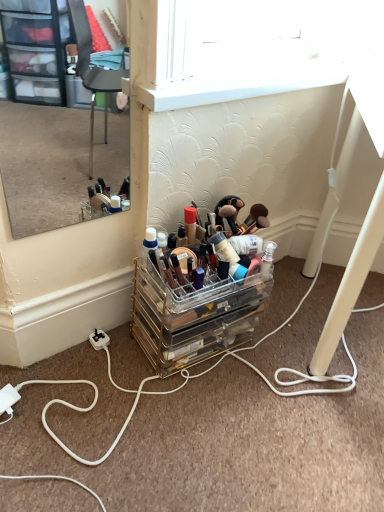
The image size is (384, 512). Describe the element at coordinates (228, 441) in the screenshot. I see `white cord at lower left` at that location.

Image resolution: width=384 pixels, height=512 pixels. What do you see at coordinates (99, 339) in the screenshot?
I see `white plastic power outlet at lower left` at bounding box center [99, 339].

You are a GUI agent. You are given a task and a screenshot of the screen. Output one action in this format:
    pyautogui.click(x=<x>, y=<y>)
    Task: Click on the clear acrylic makeup organizer at lower center
    The height and width of the screenshot is (512, 384).
    Given the screenshot: What is the action you would take?
    pyautogui.click(x=238, y=236)

The width and height of the screenshot is (384, 512). What are the coordinates of `white cord at lower left` in the screenshot? It's located at (228, 441).

Looking at this image, does clear glass mirror at upper left touch white cord at lower left?

No, clear glass mirror at upper left is not touching white cord at lower left.

Is white cord at lower left a part of clear glass mirror at upper left?

That's incorrect, white cord at lower left is not inside clear glass mirror at upper left.

Identify the location of mirror in front of the white cord at lower left. (57, 119).

Can you confirm if clear glass mirror at upper left is thinner than white cord at lower left?

Yes, clear glass mirror at upper left is thinner than white cord at lower left.

From the picture: How different are the orientations of white cord at lower left and clear acrylic makeup organizer at center in degrees?

The facing directions of white cord at lower left and clear acrylic makeup organizer at center are 133 degrees apart.

Choose the correct answer: Is white cord at lower left inside clear acrylic makeup organizer at center or outside it?

white cord at lower left is not enclosed by clear acrylic makeup organizer at center.

Where is `storage box above the white cord at lower left (from the image's perspective)`? storage box above the white cord at lower left (from the image's perspective) is located at coordinates (193, 317).

Based on the photo, which object is thinner, white plastic power outlet at lower left or clear glass mirror at upper left?

With smaller width is clear glass mirror at upper left.

From the image's perspective, which is above, white plastic power outlet at lower left or clear glass mirror at upper left?

clear glass mirror at upper left appears higher in the image.

How distant is white plastic power outlet at lower left from clear glass mirror at upper left?

They are 5.55 feet apart.

Which is behind, point (95, 333) or point (9, 182)?

The point (9, 182) is more distant.

Considering the relative positions of white cord at lower left and clear acrylic makeup organizer at lower center in the image provided, is white cord at lower left behind clear acrylic makeup organizer at lower center?

No, white cord at lower left is closer to the camera.

Does white cord at lower left contain clear acrylic makeup organizer at lower center?

That's incorrect, clear acrylic makeup organizer at lower center is not inside white cord at lower left.

Between white cord at lower left and clear acrylic makeup organizer at lower center, which one has larger width?

Wider between the two is white cord at lower left.

From a real-world perspective, which object rests below the other?

white cord at lower left, from a real-world perspective.

Which object is further away from the camera taking this photo, clear glass mirror at upper left or clear acrylic makeup organizer at lower center?

clear acrylic makeup organizer at lower center is more distant.

Between clear glass mirror at upper left and clear acrylic makeup organizer at lower center, which one has larger width?

Wider between the two is clear acrylic makeup organizer at lower center.

Which is further, (126, 140) or (237, 204)?

Point (126, 140)

From the image's perspective, is clear glass mirror at upper left beneath clear acrylic makeup organizer at lower center?

No.

Considering the relative positions of clear acrylic makeup organizer at lower center and clear acrylic makeup organizer at center in the image provided, is clear acrylic makeup organizer at lower center to the right of clear acrylic makeup organizer at center from the viewer's perspective?

Correct, you'll find clear acrylic makeup organizer at lower center to the right of clear acrylic makeup organizer at center.

Is clear acrylic makeup organizer at lower center oriented towards clear acrylic makeup organizer at center?

No, clear acrylic makeup organizer at lower center is not turned towards clear acrylic makeup organizer at center.

From the image's perspective, between clear acrylic makeup organizer at lower center and clear acrylic makeup organizer at center, who is located below?

clear acrylic makeup organizer at center appears lower in the image.

Can you tell me how much clear acrylic makeup organizer at lower center and clear acrylic makeup organizer at center differ in facing direction?

0.823 degrees.

Is white plastic power outlet at lower left not near white cord at lower left?

white plastic power outlet at lower left is actually quite close to white cord at lower left.

This screenshot has width=384, height=512. What are the coordinates of `power outlet to the left of white cord at lower left` in the screenshot? It's located at coord(99,339).

Who is more distant, white plastic power outlet at lower left or white cord at lower left?

white plastic power outlet at lower left.

Between white plastic power outlet at lower left and white cord at lower left, which one has smaller width?

white plastic power outlet at lower left is thinner.

Where is `mirror lying in front of the white cord at lower left`? The image size is (384, 512). mirror lying in front of the white cord at lower left is located at coordinates (57, 119).

Where is `cable below the clear acrylic makeup organizer at center (from the image's perspective)`? The width and height of the screenshot is (384, 512). cable below the clear acrylic makeup organizer at center (from the image's perspective) is located at coordinates (228, 441).

Estimate the real-world distances between objects in this image. Which object is closer to clear acrylic makeup organizer at center, white plastic power outlet at lower left or white cord at lower left?

white cord at lower left.

Estimate the real-world distances between objects in this image. Which object is further from clear glass mirror at upper left, white plastic power outlet at lower left or white cord at lower left?

white plastic power outlet at lower left lies further to clear glass mirror at upper left than the other object.

Estimate the real-world distances between objects in this image. Which object is further from white cord at lower left, white plastic power outlet at lower left or clear acrylic makeup organizer at lower center?

white plastic power outlet at lower left is further to white cord at lower left.

When comparing their distances from clear acrylic makeup organizer at lower center, does clear glass mirror at upper left or clear acrylic makeup organizer at center seem further?

clear glass mirror at upper left.

When comparing their distances from white cord at lower left, does clear acrylic makeup organizer at center or white plastic power outlet at lower left seem further?

The object further to white cord at lower left is white plastic power outlet at lower left.

From the image, which object appears to be farther from white plastic power outlet at lower left, clear acrylic makeup organizer at lower center or clear acrylic makeup organizer at center?

clear acrylic makeup organizer at lower center is positioned further to the anchor white plastic power outlet at lower left.

Considering their positions, is white plastic power outlet at lower left positioned further to white cord at lower left than clear glass mirror at upper left?

clear glass mirror at upper left lies further to white cord at lower left than the other object.

Considering their positions, is clear acrylic makeup organizer at center positioned closer to white plastic power outlet at lower left than white cord at lower left?

clear acrylic makeup organizer at center.

I want to click on storage box between clear glass mirror at upper left and white cord at lower left in the up-down direction, so click(193, 317).

Locate an element on the screen. The width and height of the screenshot is (384, 512). storage box located between white plastic power outlet at lower left and clear acrylic makeup organizer at lower center in the left-right direction is located at coordinates (193, 317).

This screenshot has height=512, width=384. In order to click on storage box between clear acrylic makeup organizer at lower center and white cord at lower left vertically in this screenshot , I will do `click(193, 317)`.

The image size is (384, 512). Identify the location of toiletry between clear glass mirror at upper left and white plastic power outlet at lower left in the front-back direction. (238, 236).